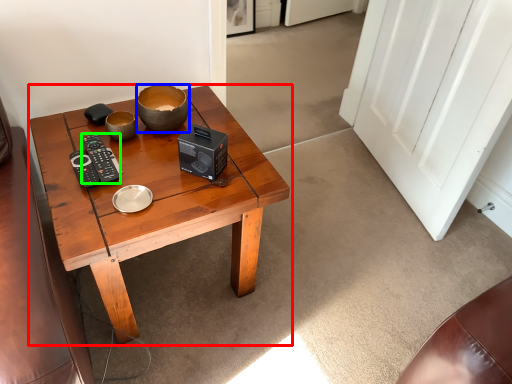
Question: Which object is positioned closest to coffee table (highlighted by a red box)? Select from bowl (highlighted by a blue box) and control (highlighted by a green box).

Choices:
 (A) bowl
 (B) control

Answer: (B)